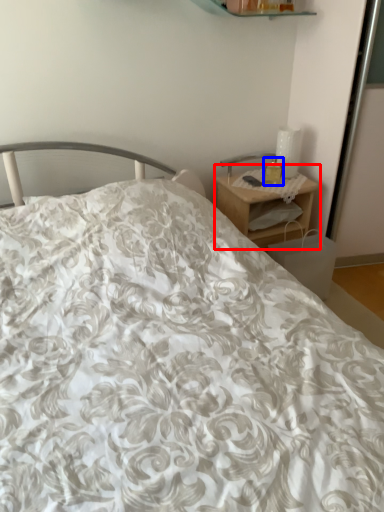
Question: Which object appears closest to the camera in this image, nightstand (highlighted by a red box) or candle holder (highlighted by a blue box)?

Choices:
 (A) nightstand
 (B) candle holder

Answer: (A)